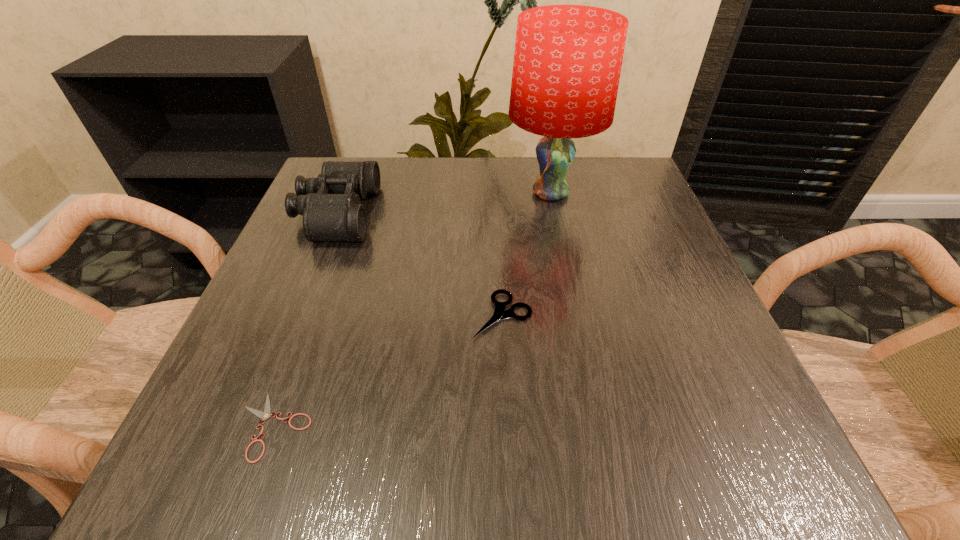
What are the coordinates of `vacant space that's between the lampshade and the taller shears` in the screenshot? It's located at (526, 254).

Find the location of `empty space between the tallest object and the binoculars`. empty space between the tallest object and the binoculars is located at coordinates (444, 204).

At what (x,y) coordinates should I click in order to perform the action: click on vacant point located between the farther shears and the binoculars. Please return your answer as a coordinate pair (x, y). The height and width of the screenshot is (540, 960). Looking at the image, I should click on (420, 265).

This screenshot has height=540, width=960. I want to click on free spot between the tallest object and the nearest object, so click(412, 310).

Locate an element on the screen. This screenshot has width=960, height=540. free spot between the binoculars and the farther shears is located at coordinates pos(420,265).

Locate which object ranks second in proximity to the nearer shears. Please provide its 2D coordinates. Your answer should be formatted as a tuple, i.e. [(x, y)], where the tuple contains the x and y coordinates of a point satisfying the conditions above.

[(330, 204)]

Select which object is the closest to the third tallest object. Please provide its 2D coordinates. Your answer should be formatted as a tuple, i.e. [(x, y)], where the tuple contains the x and y coordinates of a point satisfying the conditions above.

[(567, 63)]

Where is `vacant area in the image that satisfies the following two spatial constraints: 1. at the eyepieces of the binoculars; 2. on the left side of the nearest object`? This screenshot has height=540, width=960. vacant area in the image that satisfies the following two spatial constraints: 1. at the eyepieces of the binoculars; 2. on the left side of the nearest object is located at coordinates (253, 426).

Locate an element on the screen. vacant space that satisfies the following two spatial constraints: 1. at the eyepieces of the binoculars; 2. on the left side of the taller shears is located at coordinates (297, 315).

The image size is (960, 540). In order to click on free space that satisfies the following two spatial constraints: 1. at the eyepieces of the binoculars; 2. on the back side of the taller shears in this screenshot , I will do `click(297, 315)`.